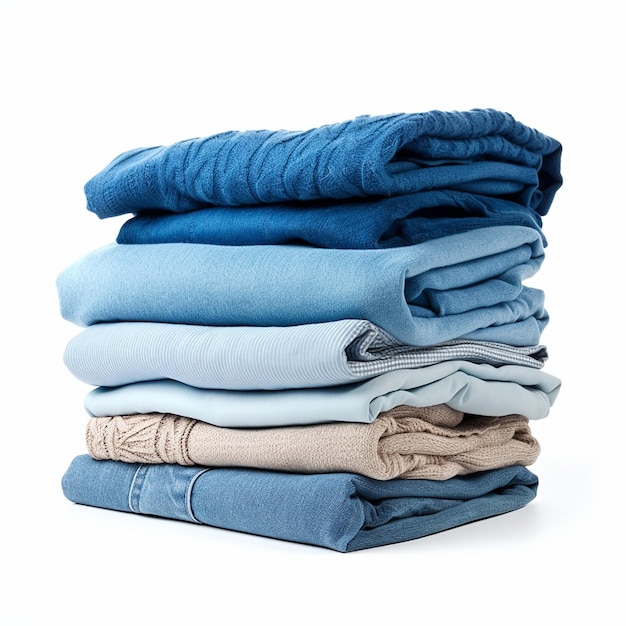
This screenshot has height=626, width=626. What are the coordinates of `folded clothes` in the screenshot? It's located at (227, 500), (259, 446), (244, 408), (235, 352), (275, 221), (248, 279), (279, 173).